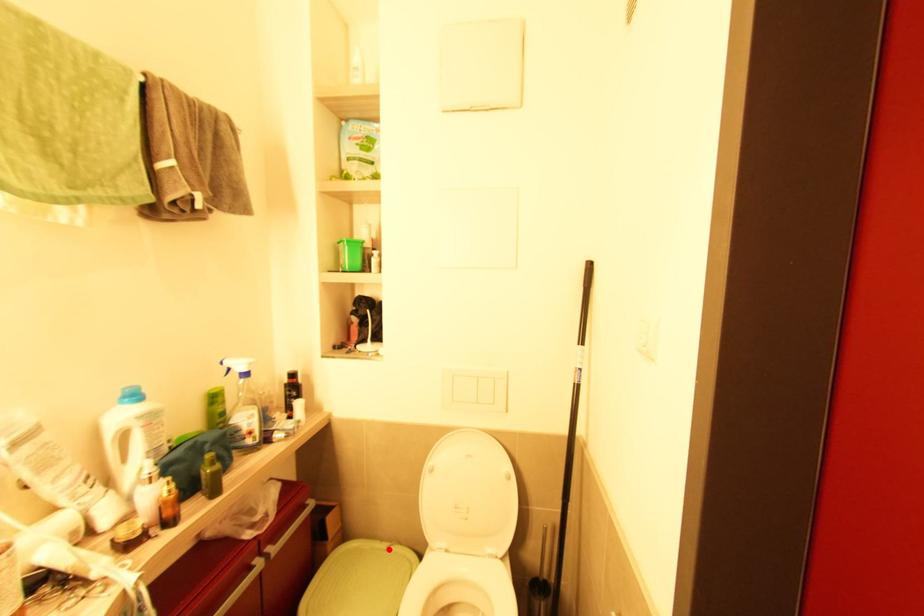
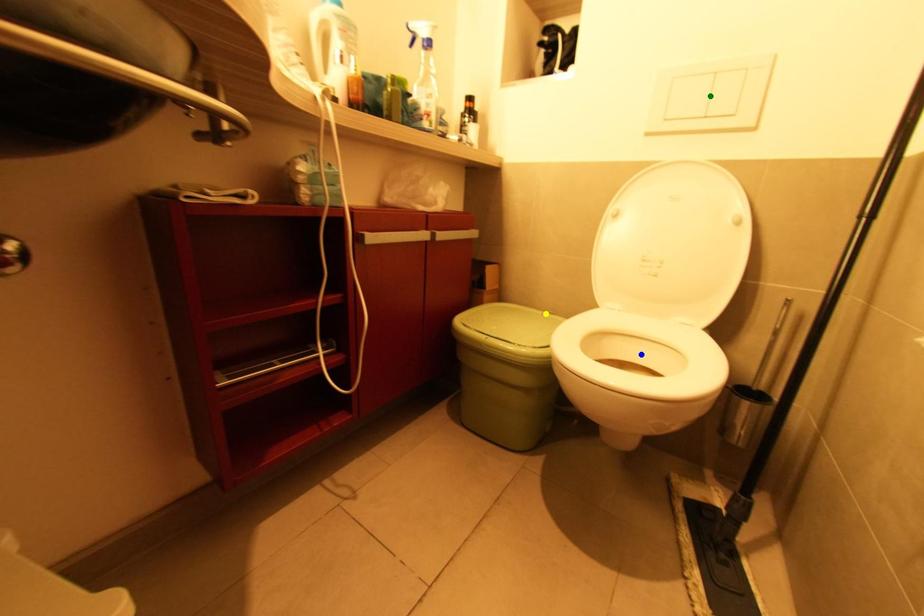
Question: I am providing you with two images of the same scene from different viewpoints. A red point is marked on the first image. You are given multiple points on the second image. Which mark in image 2 goes with the point in image 1?

Choices:
 (A) green point
 (B) blue point
 (C) yellow point

Answer: (C)